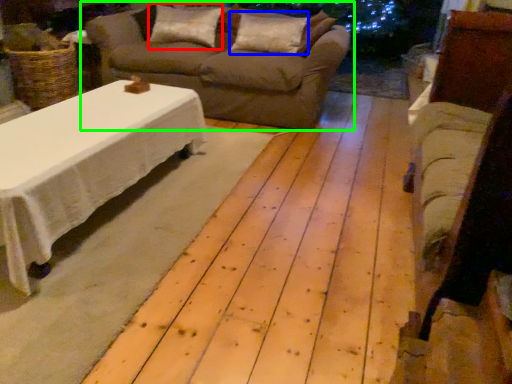
Question: Which object is the farthest from pillow (highlighted by a red box)? Choose among these: pillow (highlighted by a blue box) or studio couch (highlighted by a green box).

Choices:
 (A) pillow
 (B) studio couch

Answer: (A)